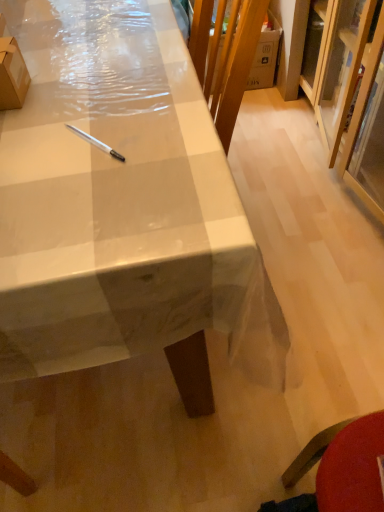
Describe the element at coordinates (114, 200) in the screenshot. I see `white glossy desk at center` at that location.

What are the coordinates of `white glossy desk at center` in the screenshot? It's located at (114, 200).

In order to face white glossy desk at center, should I rotate leftwards or rightwards?

You should rotate left by 17.266 degrees.

Where is `white glossy desk at center`? This screenshot has height=512, width=384. white glossy desk at center is located at coordinates (114, 200).